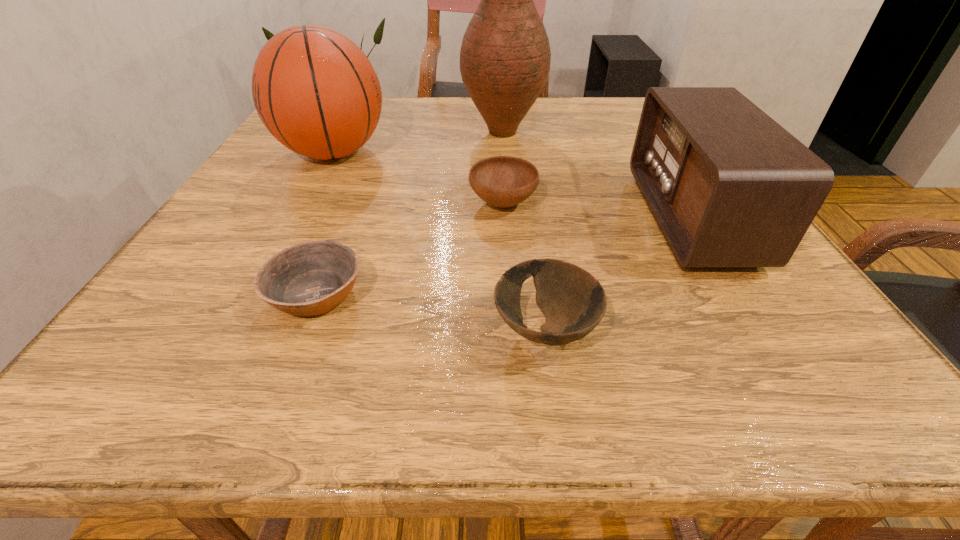
Where is `vacant space in between the farthest bowl and the basketball`? The image size is (960, 540). vacant space in between the farthest bowl and the basketball is located at coordinates (418, 178).

Identify the location of free space between the leftmost bowl and the vase. (410, 213).

The height and width of the screenshot is (540, 960). Identify the location of vacant region between the farthest bowl and the shortest bowl. (410, 249).

Identify the location of free space between the radio receiver and the tallest object. The image size is (960, 540). (596, 175).

Identify the location of vacant area between the fifth shortest object and the shortest bowl. (324, 224).

Locate which object is the fifth closest to the farthest bowl. Please provide its 2D coordinates. Your answer should be formatted as a tuple, i.e. [(x, y)], where the tuple contains the x and y coordinates of a point satisfying the conditions above.

[(729, 187)]

Point out which object is positioned as the nearest to the fourth shortest object. Please provide its 2D coordinates. Your answer should be formatted as a tuple, i.e. [(x, y)], where the tuple contains the x and y coordinates of a point satisfying the conditions above.

[(573, 302)]

Select which bowl appears as the closest to the leftmost bowl. Please provide its 2D coordinates. Your answer should be formatted as a tuple, i.e. [(x, y)], where the tuple contains the x and y coordinates of a point satisfying the conditions above.

[(503, 181)]

Identify the location of the closest bowl to the shortest object. pyautogui.click(x=503, y=181).

Find the location of `free space that satisfies the following two spatial constraints: 1. on the front-facing side of the fourth shortest object; 2. on the front side of the shortest object`. free space that satisfies the following two spatial constraints: 1. on the front-facing side of the fourth shortest object; 2. on the front side of the shortest object is located at coordinates (738, 294).